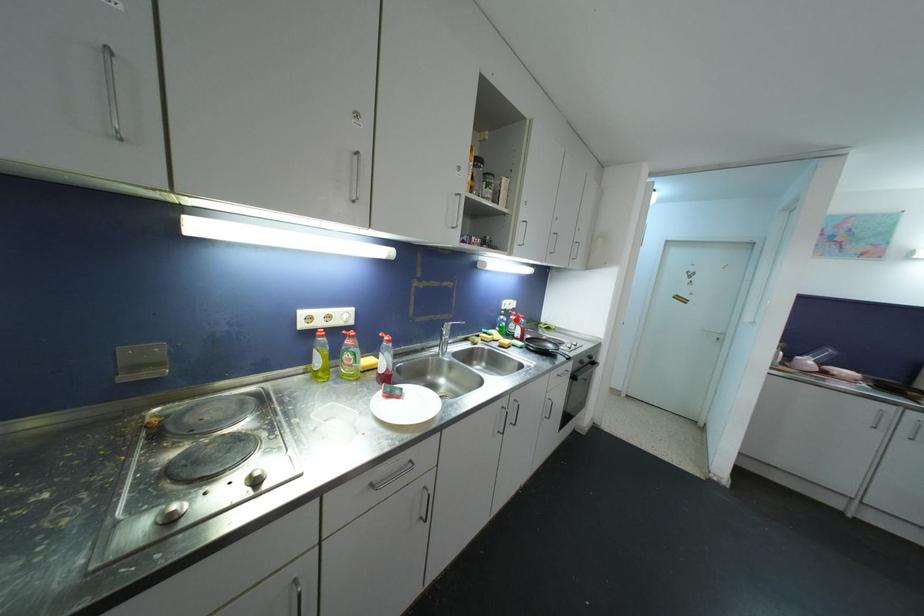
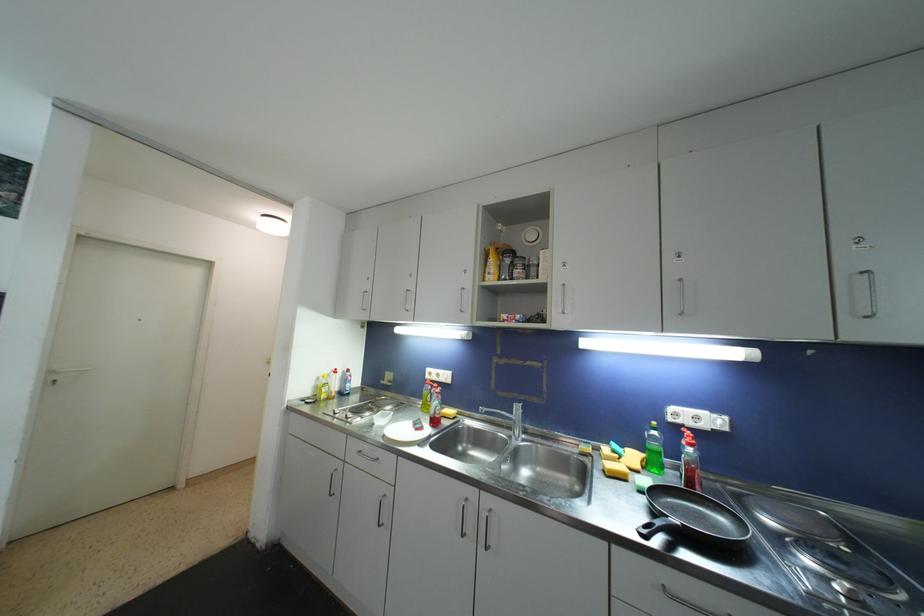
Find the pixel in the second image that matches the highlighted location in the first image.

(687, 445)